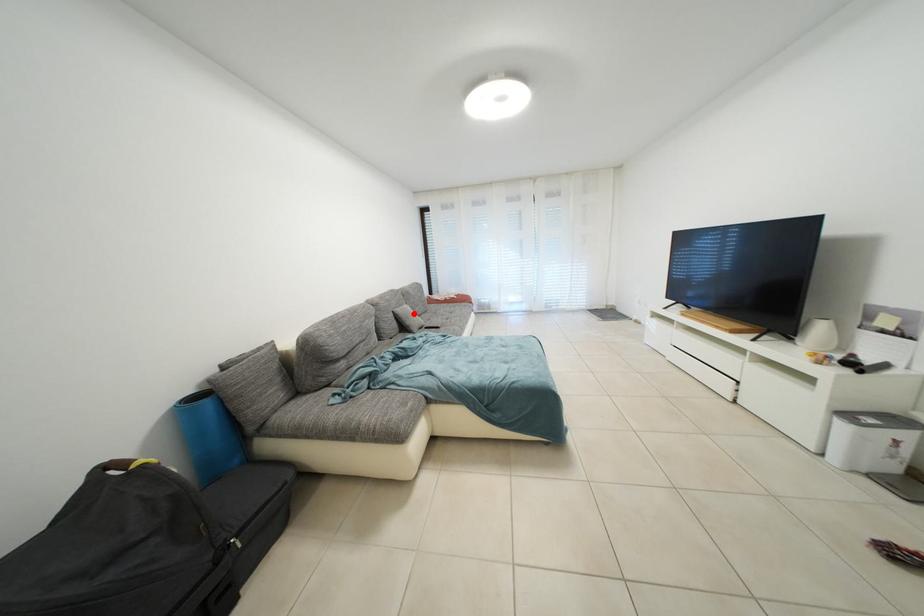
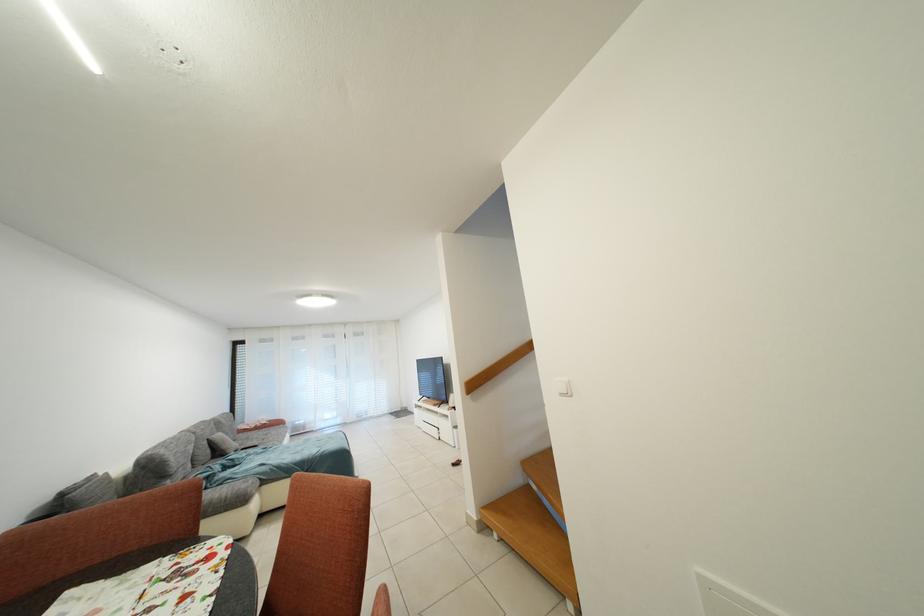
Find the pixel in the second image that matches the highlighted location in the first image.

(227, 440)